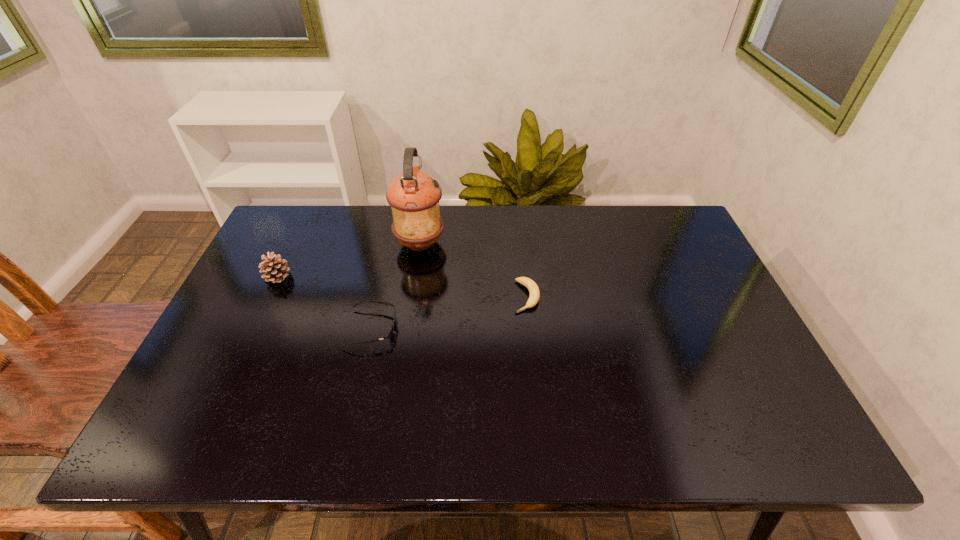
The width and height of the screenshot is (960, 540). Identify the location of oil lamp. (413, 195).

What are the coordinates of `the tallest object` in the screenshot? It's located at (413, 195).

Locate an element on the screen. Image resolution: width=960 pixels, height=540 pixels. pinecone is located at coordinates (275, 268).

This screenshot has height=540, width=960. I want to click on the leftmost object, so click(x=275, y=268).

Locate an element on the screen. the second shortest object is located at coordinates (389, 335).

I want to click on the rightmost object, so click(534, 294).

At what (x,y) coordinates should I click in order to perform the action: click on banana. Please return your answer as a coordinate pair (x, y). Looking at the image, I should click on click(x=534, y=294).

Where is `free location located 0.140m on the left of the oil lamp`? This screenshot has width=960, height=540. free location located 0.140m on the left of the oil lamp is located at coordinates (350, 243).

I want to click on vacant space situated 0.370m on the front of the pinecone, so click(x=218, y=403).

Locate an element on the screen. The width and height of the screenshot is (960, 540). free location located on the front-facing side of the sunglasses is located at coordinates (519, 328).